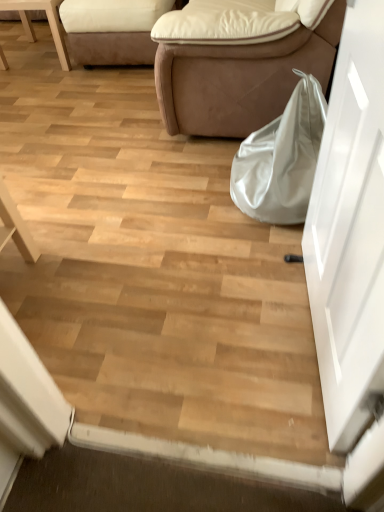
This screenshot has height=512, width=384. I want to click on space that is in front of suede beige studio couch at upper left, the 2th studio couch positioned from the right, so click(x=106, y=90).